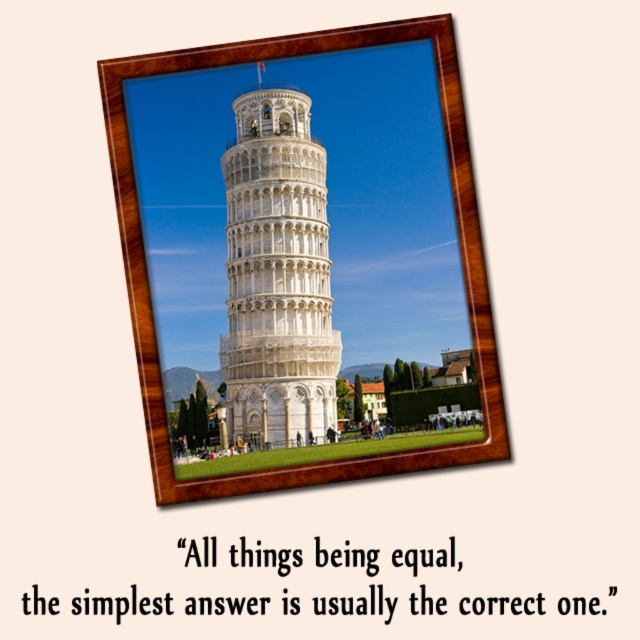
You are a tourist standing in front of the Leaning Tower of Pisa. You notice a wooden frame at center and a white marble tower at center. Which object is closer to you?

The wooden frame at center is closer to the viewer than the white marble tower at center.

You are a tourist standing in front of the Leaning Tower of Pisa. You notice a wooden frame at center and a white marble tower at center. Which object is positioned lower in the image?

The wooden frame at center is below the white marble tower at center, so the wooden frame at center is positioned lower in the image.